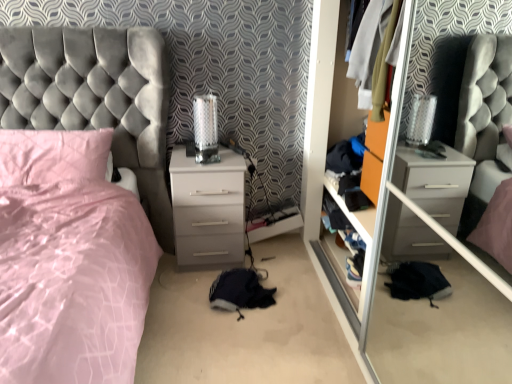
Question: Are transparent glass door at center and white glossy chest of drawers at center located far from each other?

Choices:
 (A) no
 (B) yes

Answer: (A)

Question: Is transparent glass door at center aimed at white glossy chest of drawers at center?

Choices:
 (A) no
 (B) yes

Answer: (B)

Question: Is transparent glass door at center looking in the opposite direction of white glossy chest of drawers at center?

Choices:
 (A) yes
 (B) no

Answer: (B)

Question: Considering the relative positions of transparent glass door at center and white glossy chest of drawers at center in the image provided, is transparent glass door at center to the left of white glossy chest of drawers at center from the viewer's perspective?

Choices:
 (A) no
 (B) yes

Answer: (A)

Question: Is transparent glass door at center taller than white glossy chest of drawers at center?

Choices:
 (A) no
 (B) yes

Answer: (B)

Question: Can you confirm if transparent glass door at center is thinner than white glossy chest of drawers at center?

Choices:
 (A) no
 (B) yes

Answer: (A)

Question: Is wooden shelf at center taller than white glossy chest of drawers at center?

Choices:
 (A) no
 (B) yes

Answer: (A)

Question: From the image's perspective, is wooden shelf at center below white glossy chest of drawers at center?

Choices:
 (A) no
 (B) yes

Answer: (B)

Question: Considering the relative sizes of wooden shelf at center and white glossy chest of drawers at center in the image provided, is wooden shelf at center thinner than white glossy chest of drawers at center?

Choices:
 (A) yes
 (B) no

Answer: (A)

Question: Considering the relative sizes of wooden shelf at center and white glossy chest of drawers at center in the image provided, is wooden shelf at center smaller than white glossy chest of drawers at center?

Choices:
 (A) yes
 (B) no

Answer: (A)

Question: Considering the relative sizes of wooden shelf at center and white glossy chest of drawers at center in the image provided, is wooden shelf at center bigger than white glossy chest of drawers at center?

Choices:
 (A) yes
 (B) no

Answer: (B)

Question: Is wooden shelf at center further to camera compared to white glossy chest of drawers at center?

Choices:
 (A) no
 (B) yes

Answer: (A)

Question: Does wooden shelf at center have a smaller size compared to satin pink pillow at left?

Choices:
 (A) yes
 (B) no

Answer: (A)